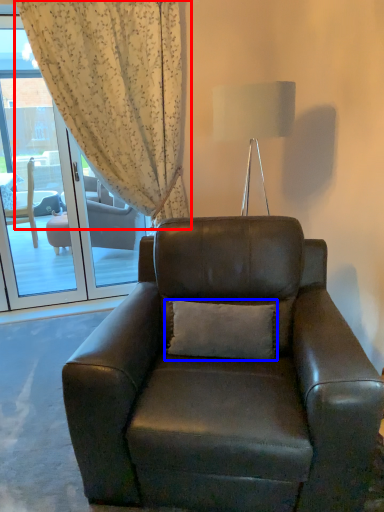
Question: Which object appears farthest to the camera in this image, curtain (highlighted by a red box) or pillow (highlighted by a blue box)?

Choices:
 (A) curtain
 (B) pillow

Answer: (A)